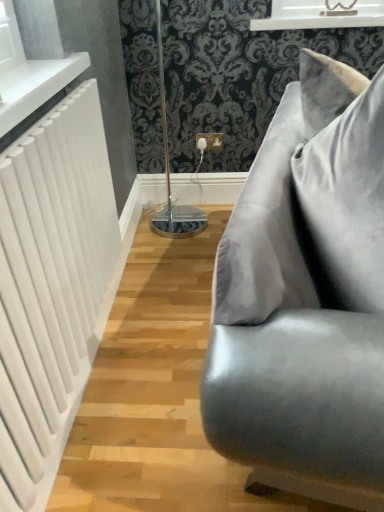
This screenshot has width=384, height=512. I want to click on free space above white matte radiator at left (from a real-world perspective), so click(52, 110).